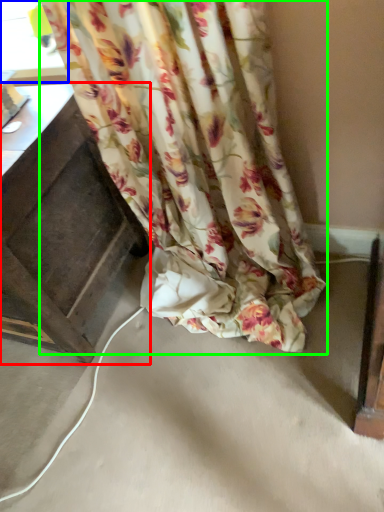
Question: Considering the real-world distances, which object is farthest from furniture (highlighted by a red box)? window (highlighted by a blue box) or curtain (highlighted by a green box)?

Choices:
 (A) window
 (B) curtain

Answer: (A)